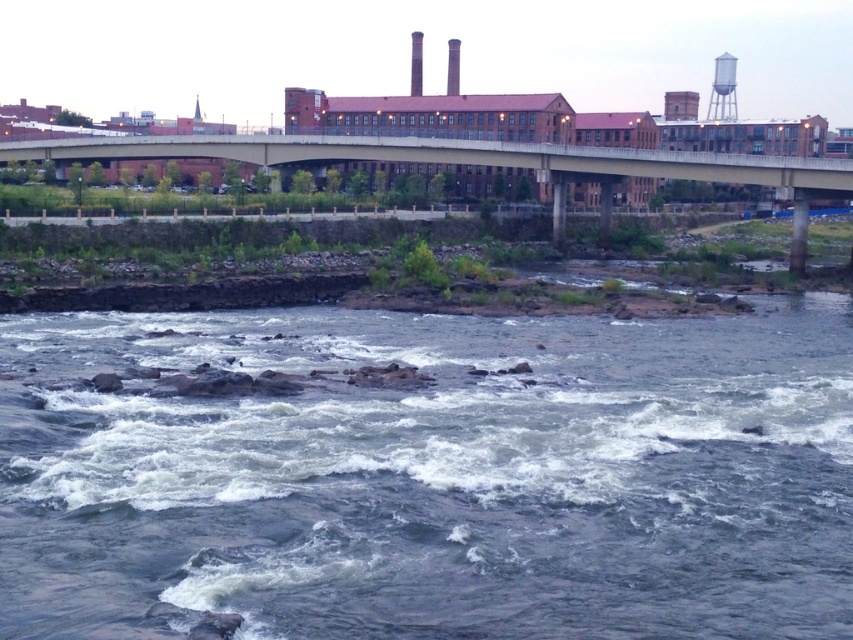
You are standing on the riverbank and want to cross to the other side. The concrete bridge at upper center and the white metallic water tower at upper right are visible. Which structure is closer to you?

The concrete bridge at upper center is closer to the viewer than the white metallic water tower at upper right, so the bridge is closer.

You are a hiker standing at the point with coordinates point [683,177]. You want to reach the point with coordinates point [84,362]. Based on the scene description, is the destination point closer to the riverbank or the middle of the river?

The point [84,362] is in front of point [683,177], which means it is closer to the riverbank than the middle of the river.